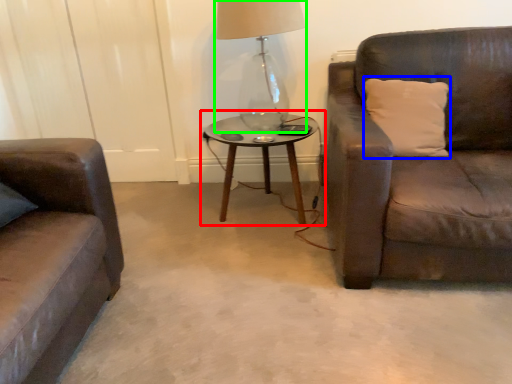
Question: Considering the real-world distances, which object is farthest from coffee table (highlighted by a red box)? pillow (highlighted by a blue box) or table lamp (highlighted by a green box)?

Choices:
 (A) pillow
 (B) table lamp

Answer: (A)